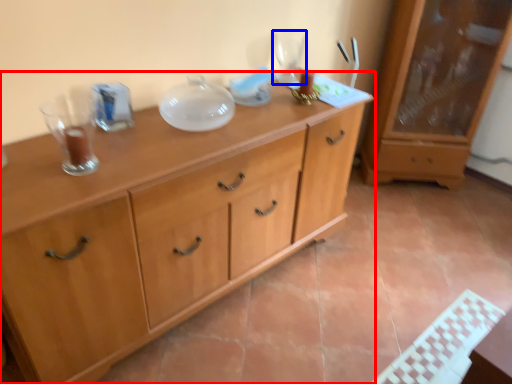
Question: Among these objects, which one is farthest to the camera, chest of drawers (highlighted by a red box) or wine glass (highlighted by a blue box)?

Choices:
 (A) chest of drawers
 (B) wine glass

Answer: (B)